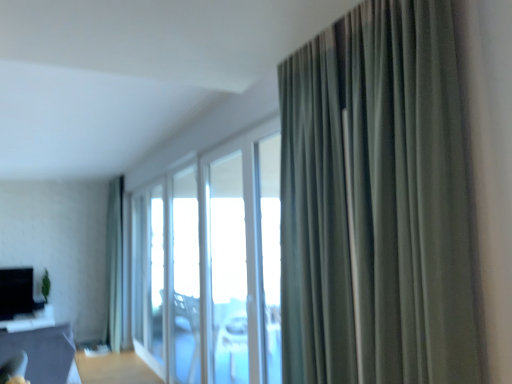
Question: Is clear glass window at center, which ranks as the third window in back-to-front order, at the back of green fabric curtain at left, which appears as the first curtain when viewed from the left?

Choices:
 (A) no
 (B) yes

Answer: (A)

Question: Is clear glass window at center, arranged as the 1th window when viewed from the front, inside green fabric curtain at left, which is the first curtain from back to front?

Choices:
 (A) yes
 (B) no

Answer: (B)

Question: Considering the relative sizes of green fabric curtain at left, the second curtain in the right-to-left sequence, and clear glass window at center, which ranks as the third window in back-to-front order, in the image provided, is green fabric curtain at left, the second curtain in the right-to-left sequence, taller than clear glass window at center, which ranks as the third window in back-to-front order,?

Choices:
 (A) no
 (B) yes

Answer: (B)

Question: Are green fabric curtain at left, which ranks as the 2th curtain in front-to-back order, and clear glass window at center, arranged as the 1th window when viewed from the front, beside each other?

Choices:
 (A) yes
 (B) no

Answer: (B)

Question: Considering the relative sizes of green fabric curtain at left, which is the first curtain from back to front, and clear glass window at center, which ranks as the third window in back-to-front order, in the image provided, is green fabric curtain at left, which is the first curtain from back to front, bigger than clear glass window at center, which ranks as the third window in back-to-front order,?

Choices:
 (A) no
 (B) yes

Answer: (B)

Question: Considering the relative sizes of green fabric curtain at left, which appears as the first curtain when viewed from the left, and clear glass window at center, arranged as the 1th window when viewed from the front, in the image provided, is green fabric curtain at left, which appears as the first curtain when viewed from the left, smaller than clear glass window at center, arranged as the 1th window when viewed from the front,?

Choices:
 (A) no
 (B) yes

Answer: (A)

Question: Can you confirm if white glass screen door at center is smaller than green fabric curtain at left, which is the first curtain from back to front?

Choices:
 (A) yes
 (B) no

Answer: (A)

Question: Is white glass screen door at center positioned with its back to green fabric curtain at left, which is the first curtain from back to front?

Choices:
 (A) yes
 (B) no

Answer: (B)

Question: Does white glass screen door at center have a lesser height compared to green fabric curtain at left, the second curtain in the right-to-left sequence?

Choices:
 (A) yes
 (B) no

Answer: (A)

Question: Is white glass screen door at center to the right of green fabric curtain at left, which is the first curtain from back to front, from the viewer's perspective?

Choices:
 (A) yes
 (B) no

Answer: (A)

Question: Is white glass screen door at center to the left of green fabric curtain at left, which is the first curtain from back to front, from the viewer's perspective?

Choices:
 (A) yes
 (B) no

Answer: (B)

Question: From the image's perspective, does white glass screen door at center appear lower than green fabric curtain at left, which appears as the first curtain when viewed from the left?

Choices:
 (A) no
 (B) yes

Answer: (A)

Question: Can you confirm if white glass screen door at center is taller than transparent glass window at center, arranged as the 2th window when viewed from the back?

Choices:
 (A) yes
 (B) no

Answer: (A)